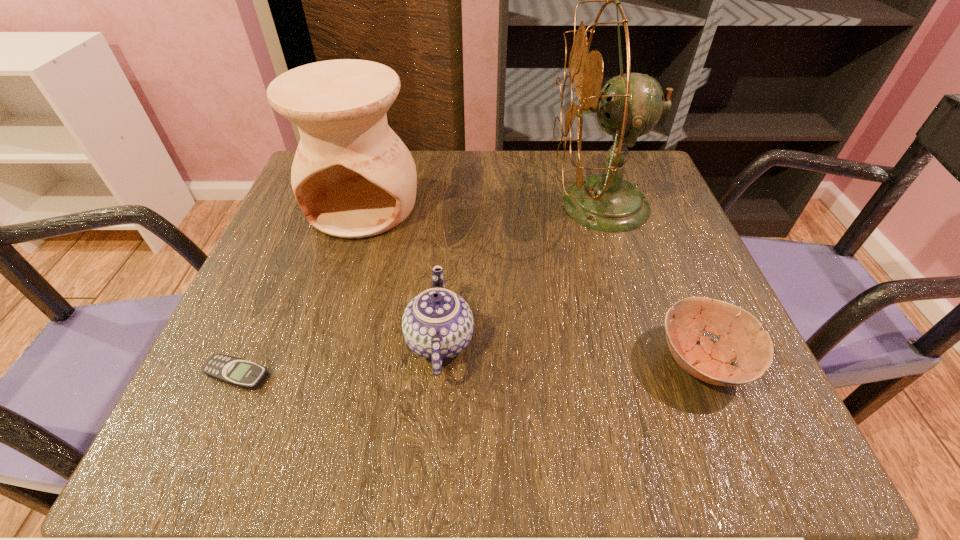
You are a GUI agent. You are given a task and a screenshot of the screen. Output one action in this format:
    pyautogui.click(x=<x>, y=<y>)
    Task: Click on the empty space between the bowl and the beeper
    
    Given the screenshot: What is the action you would take?
    (469, 367)

Where is `free spot between the third tallest object and the tallest object`? free spot between the third tallest object and the tallest object is located at coordinates (520, 273).

Locate an element on the screen. The height and width of the screenshot is (540, 960). free spot between the pottery and the third object from right to left is located at coordinates (401, 273).

The width and height of the screenshot is (960, 540). Identify the location of empty space between the second tallest object and the tallest object. (482, 205).

You are a GUI agent. You are given a task and a screenshot of the screen. Output one action in this format:
    pyautogui.click(x=<x>, y=<y>)
    Task: Click on the free space between the third tallest object and the shortest object
    Image resolution: width=960 pixels, height=540 pixels.
    Given the screenshot: What is the action you would take?
    pyautogui.click(x=338, y=357)

This screenshot has height=540, width=960. I want to click on free spot between the bowl and the beeper, so click(469, 367).

Locate an element on the screen. This screenshot has height=540, width=960. blank region between the pottery and the fan is located at coordinates (482, 205).

In order to click on free area in between the third tallest object and the fan in this screenshot , I will do `click(520, 273)`.

Find the location of a particular element. The width and height of the screenshot is (960, 540). empty space between the beeper and the chinaware is located at coordinates (338, 357).

Identify which object is located as the nearest to the second shortest object. Please provide its 2D coordinates. Your answer should be formatted as a tuple, i.e. [(x, y)], where the tuple contains the x and y coordinates of a point satisfying the conditions above.

[(630, 105)]